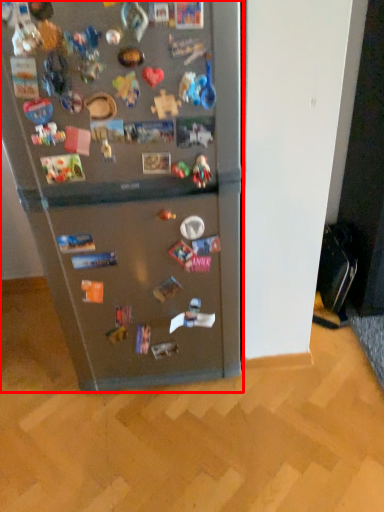
Question: From the image's perspective, considering the relative positions of refrigerator (annotated by the red box) and toy in the image provided, where is refrigerator (annotated by the red box) located with respect to the staircase?

Choices:
 (A) below
 (B) above

Answer: (A)